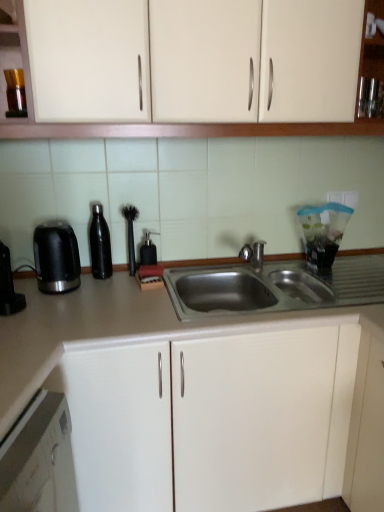
Locate an element on the screen. This screenshot has height=512, width=384. vacant area that is in front of black matte water bottle at left, which is counted as the first appliance, starting from the left is located at coordinates (98, 298).